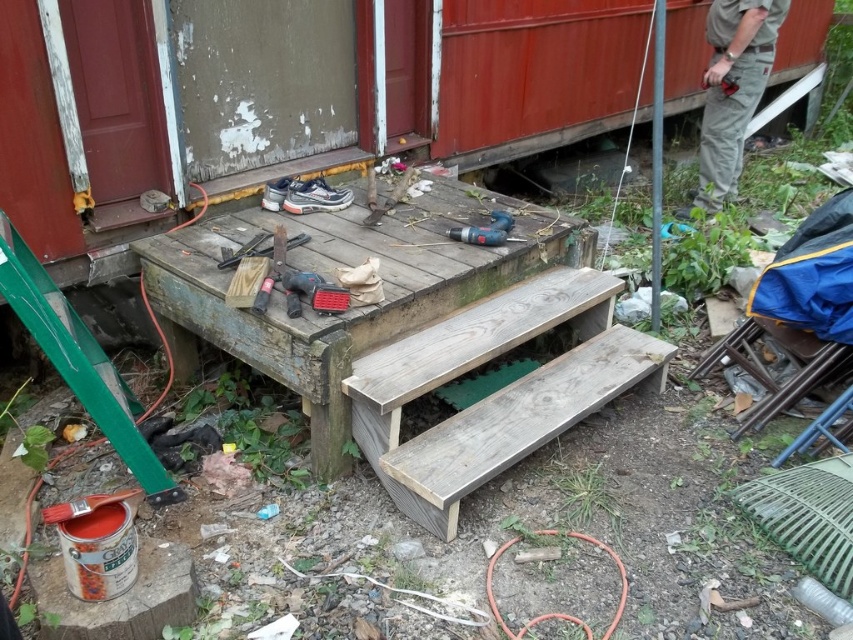
Looking at this image, you are a construction worker who needs to reach the blue plastic drill at center. You are currently standing near the khaki cotton pants at right. Which direction should you move to get to the drill?

Since the khaki cotton pants at right is further to the viewer than the blue plastic drill at center, you should move forward towards the blue plastic drill at center to reach it.

You are standing at the bottom of the wooden staircase and want to sit down. Which object, the weathered wood picnic table at center or the weathered wood bench at center, is closer to you?

The weathered wood picnic table at center is closer to you because it is further to the viewer than the weathered wood bench at center, meaning it appears nearer in the scene.

You are a construction worker standing at the bottom of the wooden staircase. You need to place a heavy tool on the nearest flat surface. Which object should you choose between the weathered wood picnic table at center and the weathered wood bench at center?

The weathered wood picnic table at center is to the left of the weathered wood bench at center, so the picnic table is closer. Therefore, you should place the heavy tool on the weathered wood picnic table at center.